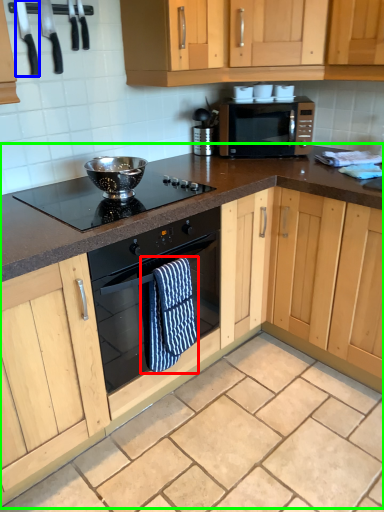
Question: Which is farther away from bath towel (highlighted by a red box)? appliance (highlighted by a blue box) or cabinetry (highlighted by a green box)?

Choices:
 (A) appliance
 (B) cabinetry

Answer: (A)